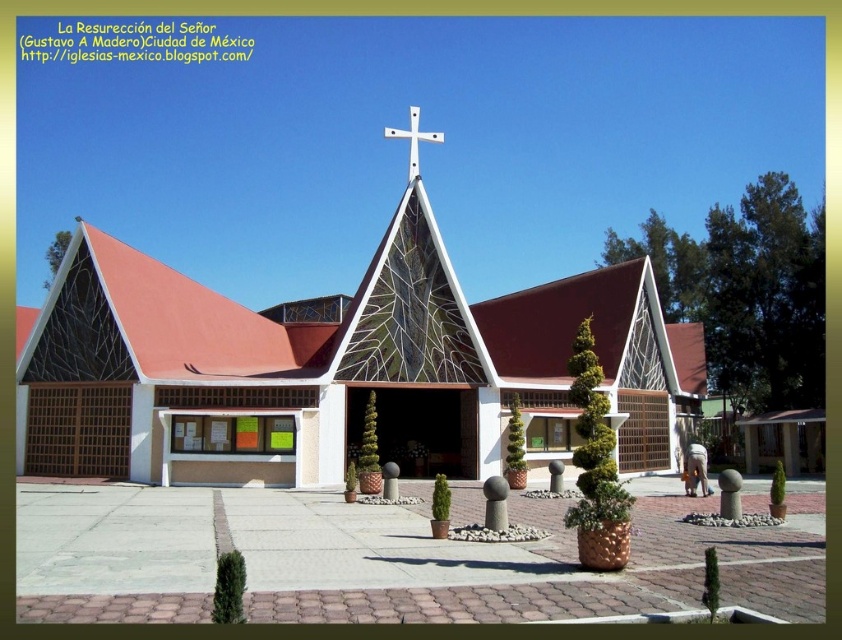
You are standing in front of the church and want to take a photo of the white glass church at center and the white metallic cross at center. Which object should you focus on first if you want to capture both in the frame without moving the camera?

The white glass church at center is below the white metallic cross at center, so you should focus on the white metallic cross at center first to ensure both are in the frame.

You are standing in front of the church and want to take a photo. There are two points on the roof that you want to capture clearly in your shot. The first point is at coordinate point[61,285] and the second is at point[414,164]. Which of these two points will appear closer to you in the photo?

Point[61,285] will appear closer to you in the photo because it is closer to the viewer than point[414,164] according to the description.

You are standing in front of the church and want to take a photo that includes both the white glass church at center and the white metallic cross at center. Which object will appear taller in your photo?

The white metallic cross at center is taller than the white glass church at center, so it will appear taller in the photo.